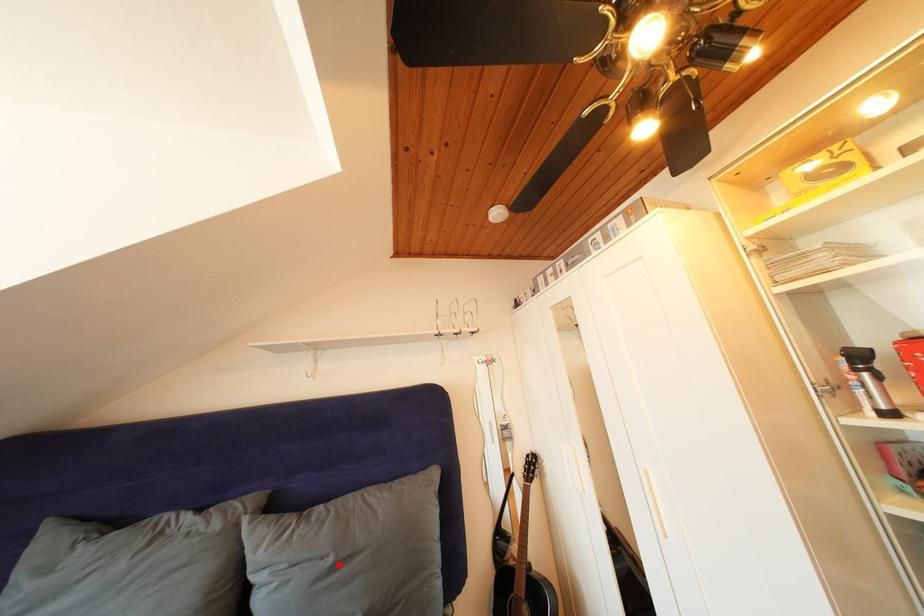
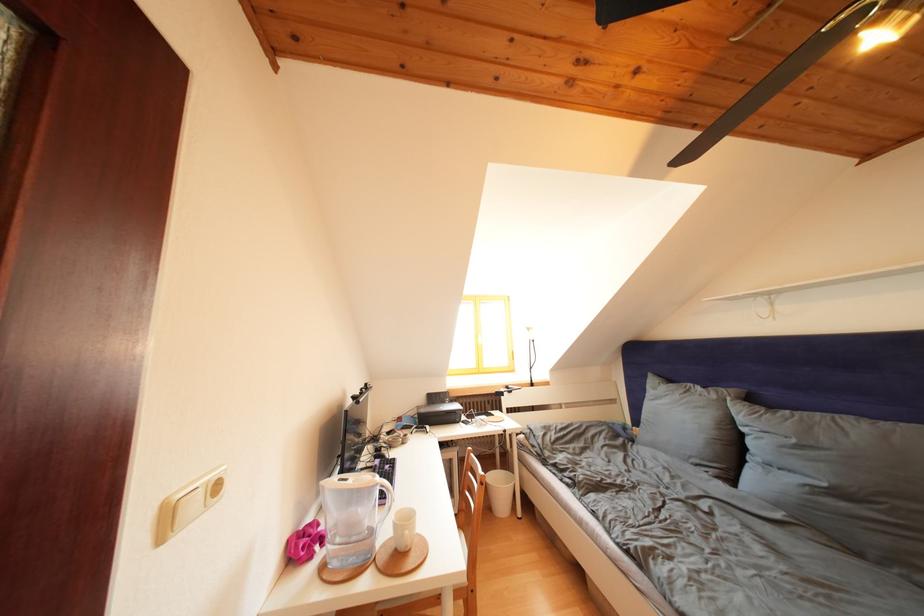
Locate, in the second image, the point that corresponds to the highlighted location in the first image.

(801, 446)